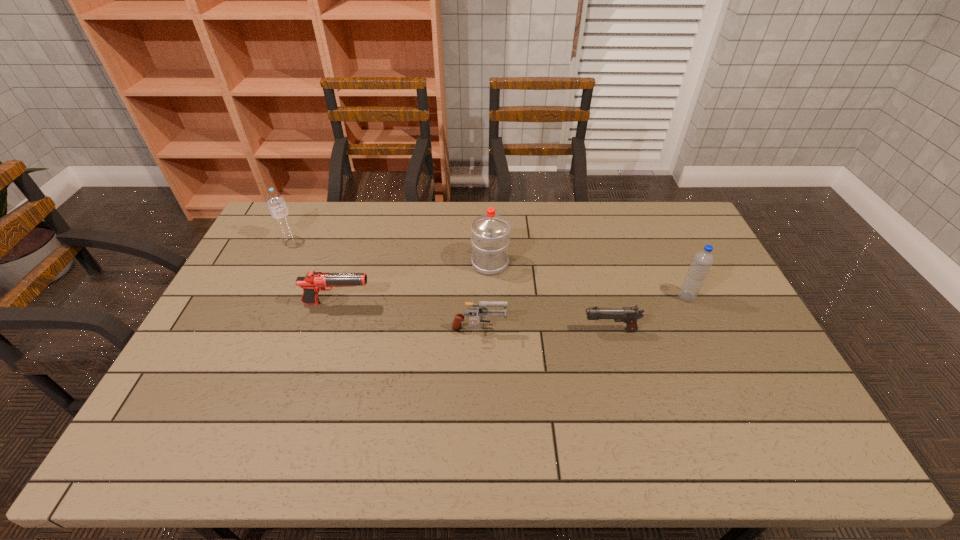
Find the location of a particular element. This screenshot has height=540, width=960. the second water bottle from right to left is located at coordinates (490, 240).

The image size is (960, 540). Identify the location of the second farthest object. (490, 240).

At what (x,y) coordinates should I click in order to perform the action: click on the leftmost object. Please return your answer as a coordinate pair (x, y). Looking at the image, I should click on (276, 203).

At what (x,y) coordinates should I click in order to perform the action: click on the farthest water bottle. Please return your answer as a coordinate pair (x, y). The width and height of the screenshot is (960, 540). Looking at the image, I should click on (276, 203).

Locate an element on the screen. Image resolution: width=960 pixels, height=540 pixels. the rightmost water bottle is located at coordinates (702, 261).

Where is `the rightmost object`? the rightmost object is located at coordinates (702, 261).

Locate an element on the screen. This screenshot has height=540, width=960. the second object from left to right is located at coordinates (313, 282).

Find the location of a particular element. The height and width of the screenshot is (540, 960). the leftmost gun is located at coordinates (313, 282).

Locate an element on the screen. the second gun from right to left is located at coordinates (482, 312).

The image size is (960, 540). In order to click on the second object from right to left in this screenshot , I will do `click(629, 315)`.